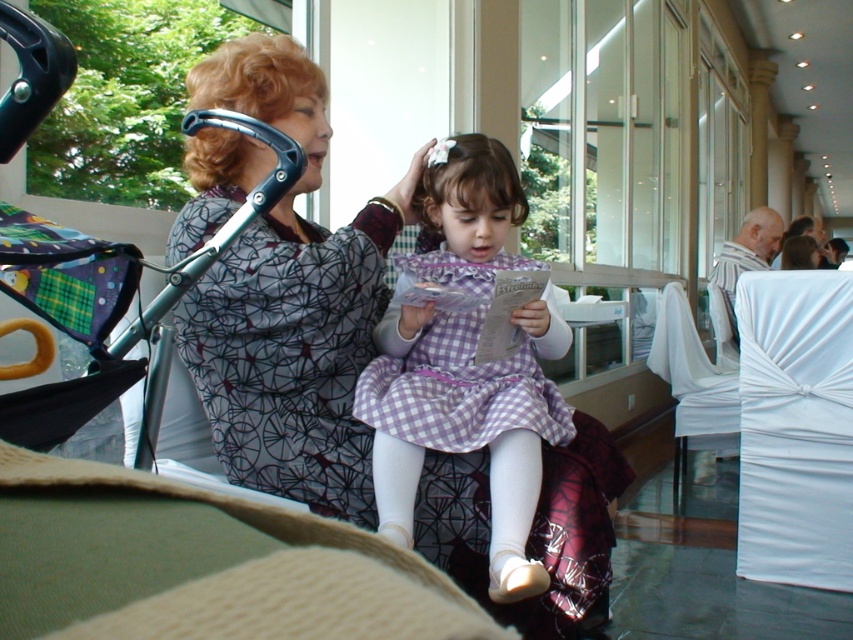
Can you confirm if purple checkered dress at center is positioned to the left of white fabric-covered chair at right?

Indeed, purple checkered dress at center is positioned on the left side of white fabric-covered chair at right.

Is purple checkered dress at center further to camera compared to white fabric-covered chair at right?

No, it is not.

Who is more forward, (x=445, y=404) or (x=686, y=308)?

Point (x=445, y=404) is more forward.

Where is `purple checkered dress at center`? purple checkered dress at center is located at coordinates [x=465, y=422].

Who is taller, checkered fabric dress at center or white satin chair at right?

Standing taller between the two is white satin chair at right.

Is point (445, 547) behind point (787, 296)?

No, (445, 547) is in front of (787, 296).

I want to click on checkered fabric dress at center, so click(x=291, y=356).

In the scene shown: Is patterned fabric dress at center shorter than white satin chair at right?

Correct, patterned fabric dress at center is not as tall as white satin chair at right.

This screenshot has height=640, width=853. I want to click on patterned fabric dress at center, so click(x=289, y=301).